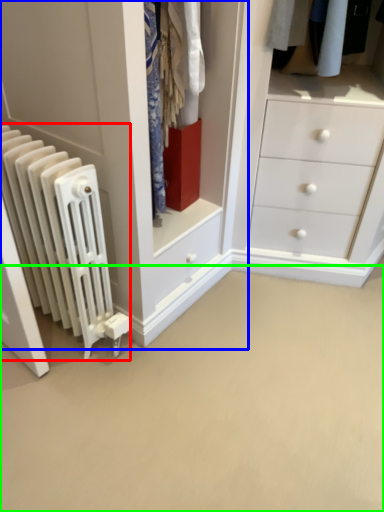
Question: Which is farther away from radiator (highlighted by a red box)? closet (highlighted by a blue box) or plain (highlighted by a green box)?

Choices:
 (A) closet
 (B) plain

Answer: (B)